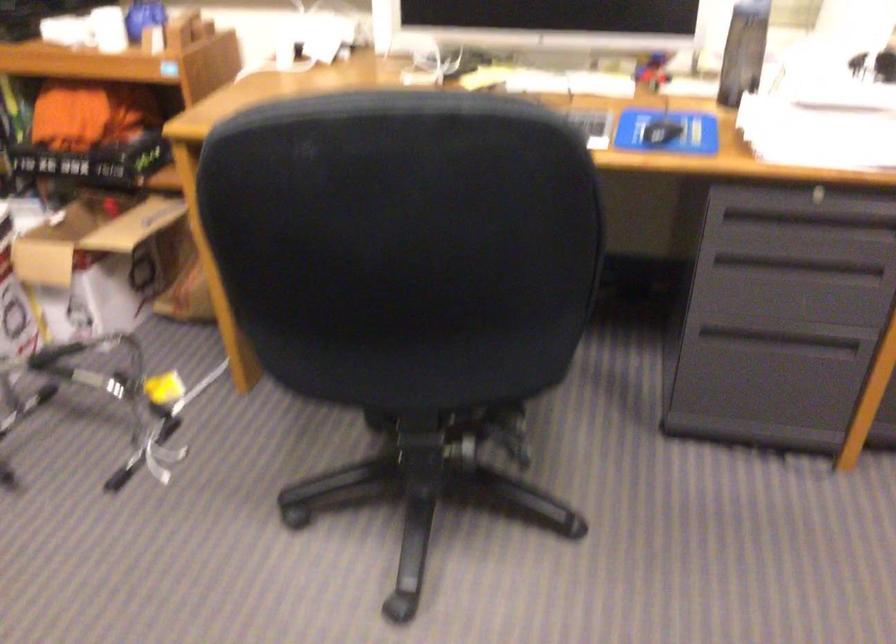
Identify the location of computer mouse. (660, 131).